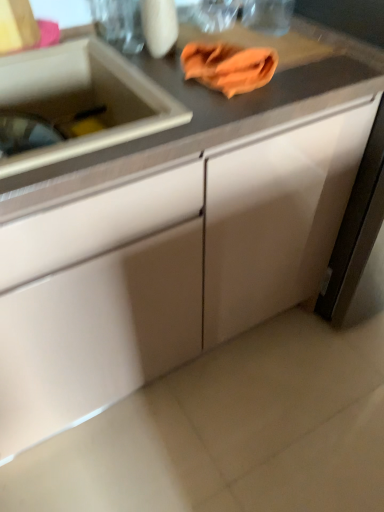
Question: Is white glossy sink at left completely or partially outside of matte white cabinet at center, the first cabinetry positioned from the left?

Choices:
 (A) yes
 (B) no

Answer: (B)

Question: Considering the relative sizes of white glossy sink at left and matte white cabinet at center, positioned as the second cabinetry in right-to-left order, in the image provided, is white glossy sink at left shorter than matte white cabinet at center, positioned as the second cabinetry in right-to-left order,?

Choices:
 (A) no
 (B) yes

Answer: (B)

Question: From a real-world perspective, is white glossy sink at left positioned under matte white cabinet at center, the first cabinetry positioned from the left, based on gravity?

Choices:
 (A) yes
 (B) no

Answer: (B)

Question: Does white glossy sink at left come behind matte white cabinet at center, the first cabinetry positioned from the left?

Choices:
 (A) yes
 (B) no

Answer: (A)

Question: Is white glossy sink at left aimed at matte white cabinet at center, the first cabinetry positioned from the left?

Choices:
 (A) no
 (B) yes

Answer: (B)

Question: Does white glossy sink at left have a larger size compared to matte white cabinet at center, positioned as the second cabinetry in right-to-left order?

Choices:
 (A) yes
 (B) no

Answer: (B)

Question: Is orange cloth at upper center shorter than white matte cabinet at right, the first cabinetry when ordered from right to left?

Choices:
 (A) yes
 (B) no

Answer: (A)

Question: Is orange cloth at upper center behind white matte cabinet at right, which is counted as the 2th cabinetry, starting from the left?

Choices:
 (A) yes
 (B) no

Answer: (A)

Question: From a real-world perspective, is orange cloth at upper center physically below white matte cabinet at right, the first cabinetry when ordered from right to left?

Choices:
 (A) no
 (B) yes

Answer: (A)

Question: Can you confirm if orange cloth at upper center is thinner than white matte cabinet at right, which is counted as the 2th cabinetry, starting from the left?

Choices:
 (A) no
 (B) yes

Answer: (B)

Question: From the image's perspective, is orange cloth at upper center over white matte cabinet at right, which is counted as the 2th cabinetry, starting from the left?

Choices:
 (A) yes
 (B) no

Answer: (A)

Question: Can you confirm if orange cloth at upper center is smaller than white matte cabinet at right, the first cabinetry when ordered from right to left?

Choices:
 (A) no
 (B) yes

Answer: (B)

Question: From the image's perspective, is white matte cabinet at right, the first cabinetry when ordered from right to left, on matte white cabinet at center, positioned as the second cabinetry in right-to-left order?

Choices:
 (A) no
 (B) yes

Answer: (B)